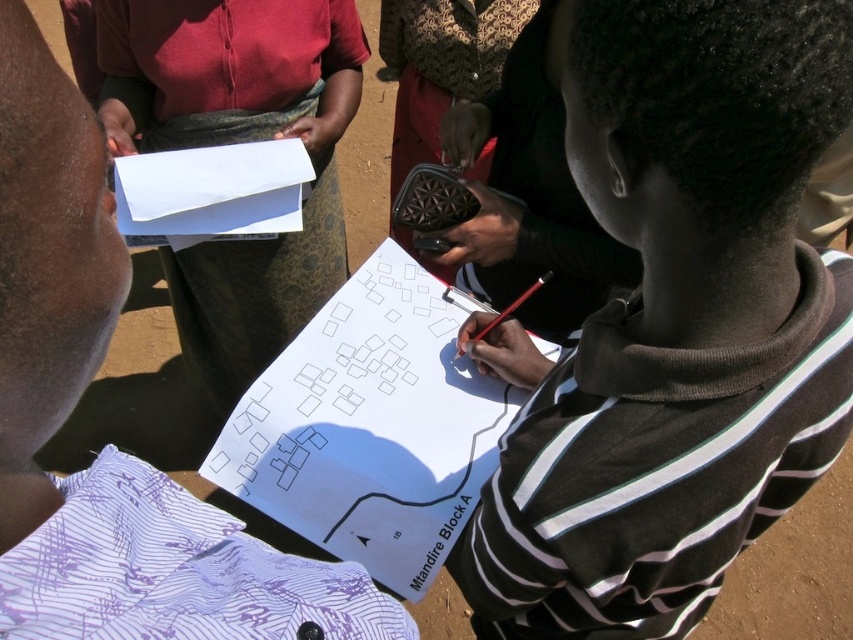
Question: Based on their relative distances, which object is nearer to the white paper at lower center?

Choices:
 (A) black striped hoodie at center
 (B) white paper at center
 (C) white paper at upper left
 (D) striped cotton shirt at center

Answer: (B)

Question: Which object is farther from the camera taking this photo?

Choices:
 (A) white paper at center
 (B) striped cotton shirt at center
 (C) white paper at lower center

Answer: (C)

Question: Which point is closer to the camera taking this photo?

Choices:
 (A) (532, 467)
 (B) (219, 225)

Answer: (A)

Question: Does white paper at center appear on the right side of white paper at lower center?

Choices:
 (A) no
 (B) yes

Answer: (A)

Question: Is black striped hoodie at center bigger than striped cotton shirt at center?

Choices:
 (A) no
 (B) yes

Answer: (B)

Question: Does striped cotton shirt at center appear on the left side of white paper at lower center?

Choices:
 (A) no
 (B) yes

Answer: (B)